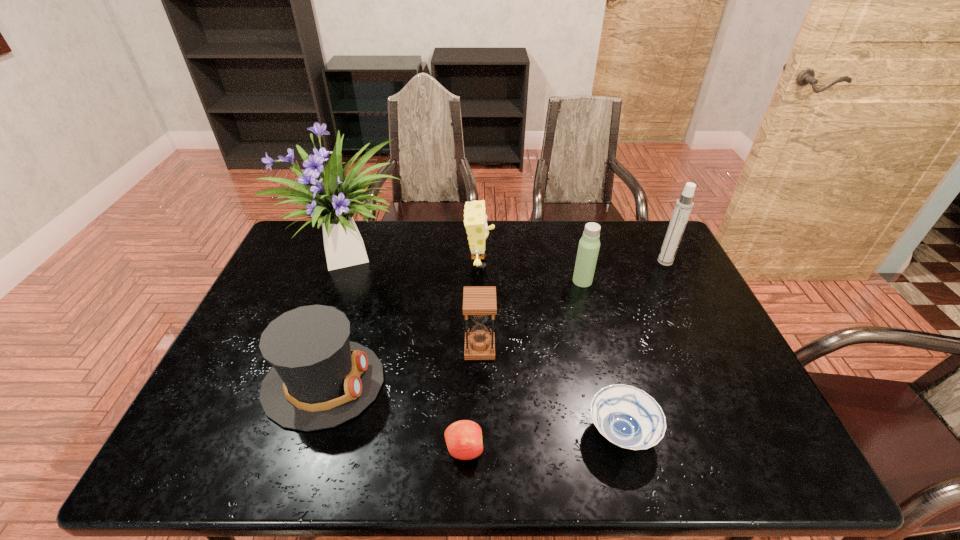
The image size is (960, 540). Find the location of `vacant point located between the flower arrangement and the aerosol can`. vacant point located between the flower arrangement and the aerosol can is located at coordinates (509, 260).

Find the location of a particular element. The image size is (960, 540). free space between the dress hat and the hourglass is located at coordinates (401, 366).

Where is `the closest object relative to the hourglass`? the closest object relative to the hourglass is located at coordinates (475, 220).

Where is `the sixth closest object relative to the thermos bottle`? the sixth closest object relative to the thermos bottle is located at coordinates (463, 438).

The height and width of the screenshot is (540, 960). Identify the location of free location that satisfies the following two spatial constraints: 1. on the front side of the hourglass; 2. with goggles on the front of the dress hat. (480, 383).

The image size is (960, 540). What are the coordinates of `free spot that satisfies the following two spatial constraints: 1. on the back side of the thermos bottle; 2. on the left side of the hourglass` in the screenshot? It's located at (480, 281).

At what (x,y) coordinates should I click in order to perform the action: click on vacant space that satisfies the following two spatial constraints: 1. with goggles on the front of the soup bowl; 2. on the right side of the dress hat. Please return your answer as a coordinate pair (x, y). Image resolution: width=960 pixels, height=540 pixels. Looking at the image, I should click on (308, 433).

This screenshot has width=960, height=540. Identify the location of vacant space that satisfies the following two spatial constraints: 1. with goggles on the front of the soup bowl; 2. on the right side of the dress hat. (308, 433).

Identify the location of free space that satisfies the following two spatial constraints: 1. on the front side of the aerosol can; 2. with goggles on the front of the dress hat. (726, 383).

The width and height of the screenshot is (960, 540). I want to click on vacant space that satisfies the following two spatial constraints: 1. on the front side of the thermos bottle; 2. with goggles on the front of the dress hat, so click(610, 383).